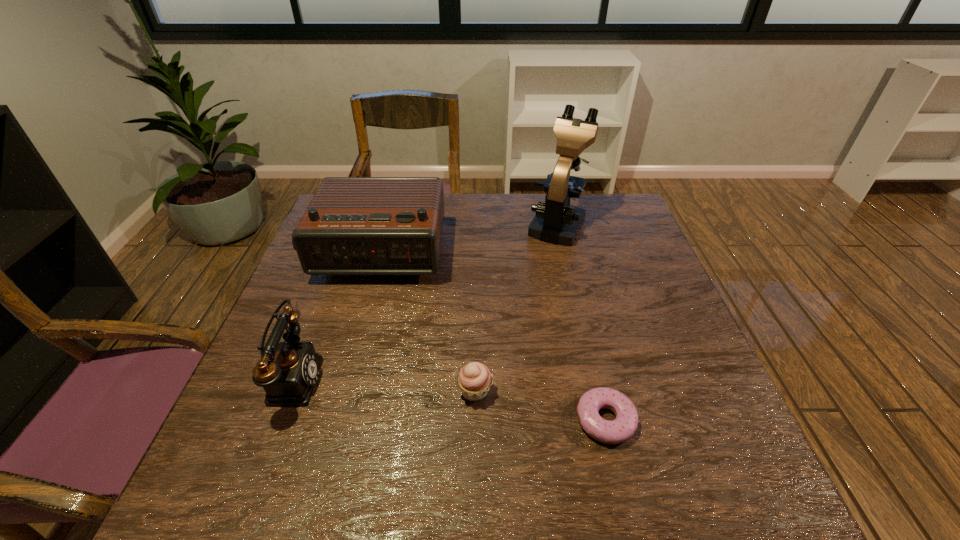
In the image, there is a desktop. In order to click on vacant space at the near left corner in this screenshot , I will do `click(206, 505)`.

This screenshot has height=540, width=960. Identify the location of vacant space at the far right corner of the desktop. (624, 195).

Identify the location of blank region between the tallest object and the telephone. (424, 301).

Find the location of `empty location between the third shortest object and the microscope`. empty location between the third shortest object and the microscope is located at coordinates coord(424,301).

Find the location of a particular element. empty space that is in between the second shortest object and the doughnut is located at coordinates (540, 406).

Where is `free area in between the shortest object and the cupcake`? free area in between the shortest object and the cupcake is located at coordinates (540, 406).

Locate an element on the screen. This screenshot has width=960, height=540. empty space between the microscope and the fourth tallest object is located at coordinates (516, 307).

I want to click on free spot between the third object from right to left and the shortest object, so click(x=540, y=406).

The width and height of the screenshot is (960, 540). I want to click on vacant area that lies between the microscope and the doughnut, so click(x=581, y=321).

Identify the location of empty space that is in between the fourth tallest object and the microscope. This screenshot has width=960, height=540. (516, 307).